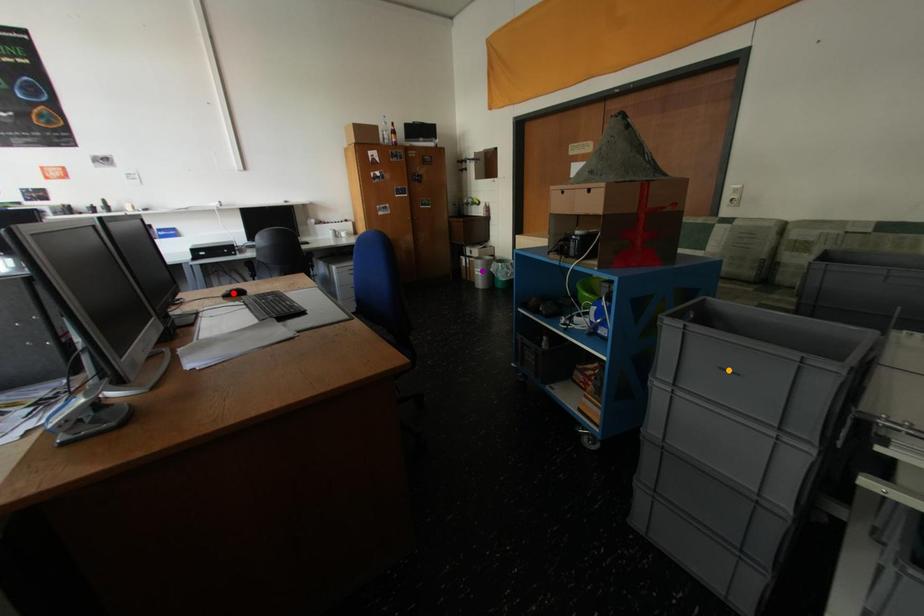
Order these from nearest to farthest:
1. red point
2. purple point
3. orange point

1. orange point
2. red point
3. purple point